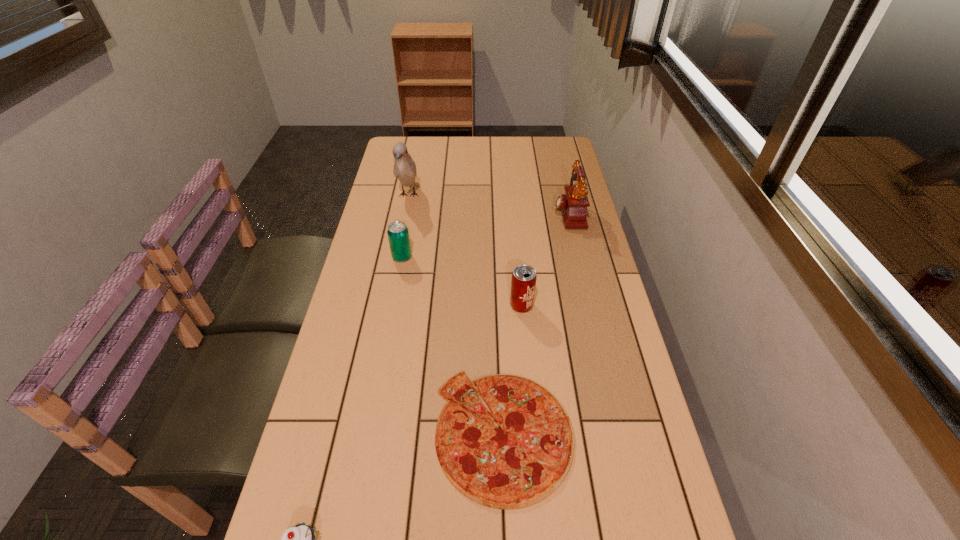
Where is `object that is the third closest to the telephone`? This screenshot has width=960, height=540. object that is the third closest to the telephone is located at coordinates (404, 169).

Find the location of a particular element. vacant space that satisfies the following two spatial constraints: 1. at the beak of the fifth farthest object; 2. on the right side of the tallest object is located at coordinates (361, 434).

Locate an element on the screen. This screenshot has height=540, width=960. vacant space that satisfies the following two spatial constraints: 1. at the beak of the farther beer can; 2. on the left side of the tallest object is located at coordinates (396, 257).

The image size is (960, 540). I want to click on free space that satisfies the following two spatial constraints: 1. at the beak of the farther beer can; 2. on the left side of the bird, so click(396, 257).